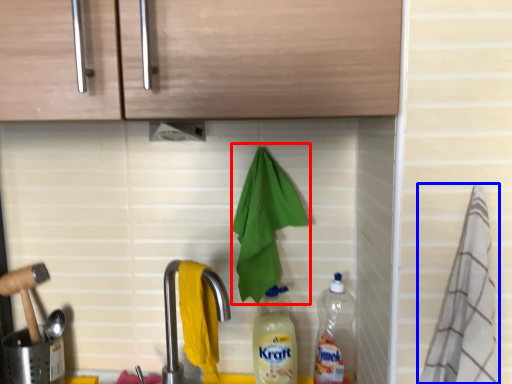
Question: Which object is further to the camera taking this photo, hand towel (highlighted by a red box) or material (highlighted by a blue box)?

Choices:
 (A) hand towel
 (B) material

Answer: (A)